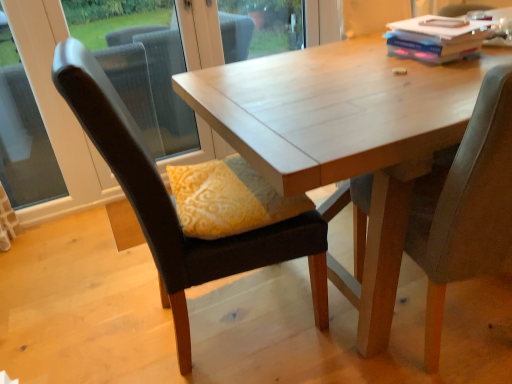
Question: Can you confirm if wooden table at center is shorter than velvet dark brown chair at center, placed as the 1th chair when sorted from left to right?

Choices:
 (A) no
 (B) yes

Answer: (B)

Question: Is wooden table at center surrounding velvet dark brown chair at center, placed as the 1th chair when sorted from left to right?

Choices:
 (A) no
 (B) yes

Answer: (B)

Question: From a real-world perspective, is wooden table at center physically above velvet dark brown chair at center, which appears as the second chair when viewed from the right?

Choices:
 (A) no
 (B) yes

Answer: (A)

Question: Is wooden table at center outside of velvet dark brown chair at center, placed as the 1th chair when sorted from left to right?

Choices:
 (A) no
 (B) yes

Answer: (B)

Question: Does wooden table at center have a greater width compared to velvet dark brown chair at center, which appears as the second chair when viewed from the right?

Choices:
 (A) no
 (B) yes

Answer: (B)

Question: Which is correct: hardcover book at upper right is inside velvet grey chair at right, the first chair from the right, or outside of it?

Choices:
 (A) outside
 (B) inside

Answer: (A)

Question: In terms of height, does hardcover book at upper right look taller or shorter compared to velvet grey chair at right, the first chair from the right?

Choices:
 (A) short
 (B) tall

Answer: (A)

Question: From a real-world perspective, is hardcover book at upper right positioned above or below velvet grey chair at right, which ranks as the second chair in left-to-right order?

Choices:
 (A) below
 (B) above

Answer: (B)

Question: In the image, is hardcover book at upper right positioned in front of or behind velvet grey chair at right, which ranks as the second chair in left-to-right order?

Choices:
 (A) behind
 (B) front

Answer: (A)

Question: From a real-world perspective, relative to yellow fabric pillow at center, is hardcover book at upper right vertically above or below?

Choices:
 (A) below
 (B) above

Answer: (B)

Question: Is hardcover book at upper right taller or shorter than yellow fabric pillow at center?

Choices:
 (A) tall
 (B) short

Answer: (B)

Question: Looking at the image, does hardcover book at upper right seem bigger or smaller compared to yellow fabric pillow at center?

Choices:
 (A) big
 (B) small

Answer: (B)

Question: Looking at their shapes, would you say hardcover book at upper right is wider or thinner than yellow fabric pillow at center?

Choices:
 (A) wide
 (B) thin

Answer: (B)

Question: Is point (438, 44) positioned closer to the camera than point (355, 173)?

Choices:
 (A) farther
 (B) closer

Answer: (A)

Question: Is hardcover book at upper right taller or shorter than wooden table at center?

Choices:
 (A) short
 (B) tall

Answer: (A)